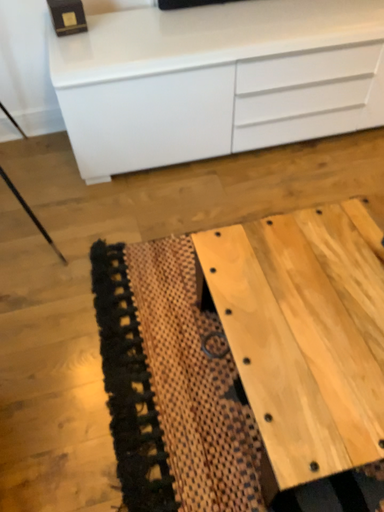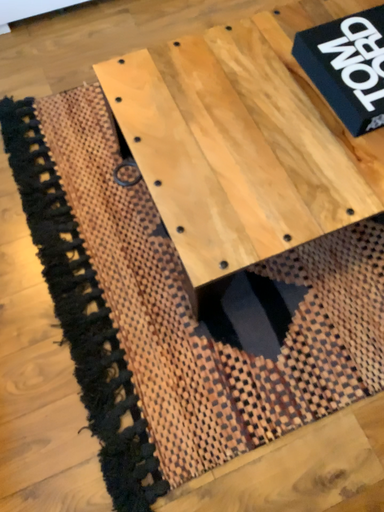
Question: How did the camera likely rotate when shooting the video?

Choices:
 (A) rotated upward
 (B) rotated downward

Answer: (B)